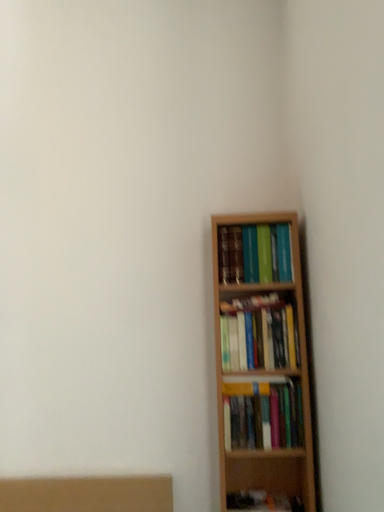
Question: Considering the relative sizes of wooden bookshelf at right, placed as the 2th book when sorted from bottom to top, and wooden bookshelf at right, marked as the third book in a top-to-bottom arrangement, in the image provided, is wooden bookshelf at right, placed as the 2th book when sorted from bottom to top, smaller than wooden bookshelf at right, marked as the third book in a top-to-bottom arrangement,?

Choices:
 (A) no
 (B) yes

Answer: (A)

Question: Does wooden bookshelf at right, placed as the 2th book when sorted from bottom to top, have a lesser height compared to wooden bookshelf at right, marked as the third book in a top-to-bottom arrangement?

Choices:
 (A) yes
 (B) no

Answer: (B)

Question: Could wooden bookshelf at right, marked as the third book in a top-to-bottom arrangement, be considered to be inside wooden bookshelf at right, placed as the 2th book when sorted from bottom to top?

Choices:
 (A) no
 (B) yes

Answer: (A)

Question: From the image's perspective, does wooden bookshelf at right, placed as the 2th book when sorted from bottom to top, appear lower than wooden bookshelf at right, placed as the 1th book when sorted from bottom to top?

Choices:
 (A) yes
 (B) no

Answer: (B)

Question: Can you confirm if wooden bookshelf at right, placed as the 2th book when sorted from bottom to top, is positioned to the left of wooden bookshelf at right, placed as the 1th book when sorted from bottom to top?

Choices:
 (A) yes
 (B) no

Answer: (A)

Question: Can you confirm if wooden bookshelf at right, placed as the 2th book when sorted from bottom to top, is wider than wooden bookshelf at right, marked as the third book in a top-to-bottom arrangement?

Choices:
 (A) yes
 (B) no

Answer: (B)

Question: Is there a large distance between wooden bookshelf at right, placed as the 2th book when sorted from bottom to top, and hardcover books at upper right, the third book ordered from the bottom?

Choices:
 (A) no
 (B) yes

Answer: (A)

Question: Is hardcover books at upper right, marked as the 1th book in a top-to-bottom arrangement, located within wooden bookshelf at right, the second book viewed from the top?

Choices:
 (A) yes
 (B) no

Answer: (B)

Question: From a real-world perspective, does wooden bookshelf at right, the second book viewed from the top, sit lower than hardcover books at upper right, the third book ordered from the bottom?

Choices:
 (A) no
 (B) yes

Answer: (B)

Question: Can you confirm if wooden bookshelf at right, the second book viewed from the top, is bigger than hardcover books at upper right, marked as the 1th book in a top-to-bottom arrangement?

Choices:
 (A) yes
 (B) no

Answer: (B)

Question: Is wooden bookshelf at right, placed as the 2th book when sorted from bottom to top, shorter than hardcover books at upper right, marked as the 1th book in a top-to-bottom arrangement?

Choices:
 (A) no
 (B) yes

Answer: (A)

Question: Is wooden bookshelf at right, placed as the 2th book when sorted from bottom to top, in contact with hardcover books at upper right, the third book ordered from the bottom?

Choices:
 (A) no
 (B) yes

Answer: (A)

Question: Is hardcover books at upper right, marked as the 1th book in a top-to-bottom arrangement, placed right next to wooden bookshelf at right, the second book viewed from the top?

Choices:
 (A) no
 (B) yes

Answer: (A)